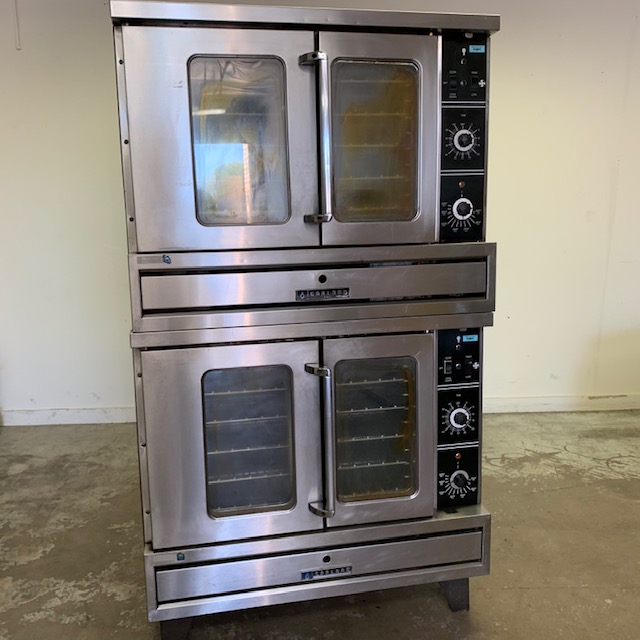
This screenshot has width=640, height=640. I want to click on reflection in oven door window, so click(225, 159).